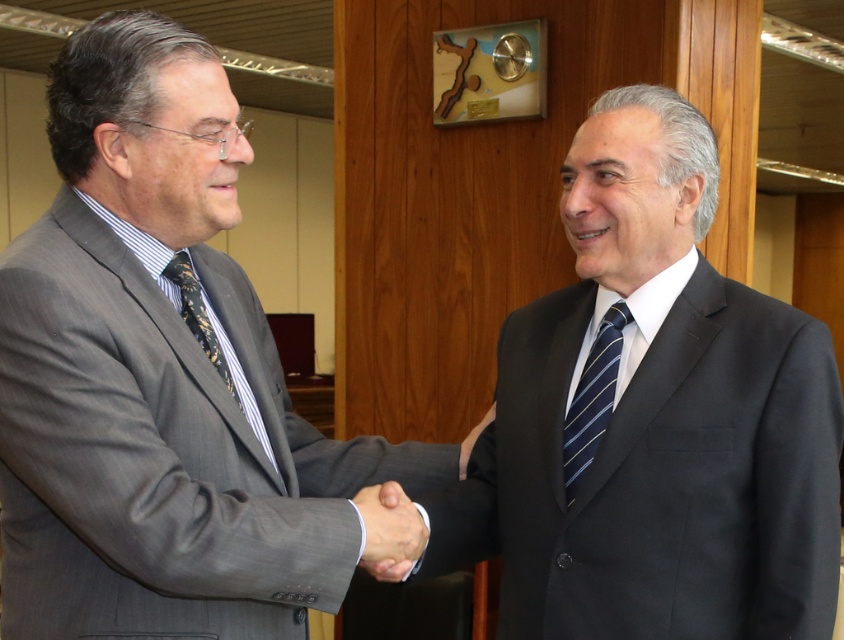
Question: Is dark gray suit at center in front of blue striped tie at center?

Choices:
 (A) yes
 (B) no

Answer: (A)

Question: Where is gray suit at left located in relation to black silk tie at left in the image?

Choices:
 (A) below
 (B) above

Answer: (B)

Question: Which point appears closest to the camera in this image?

Choices:
 (A) (580, 394)
 (B) (268, 454)
 (C) (356, 499)

Answer: (C)

Question: Which point is closer to the camera?

Choices:
 (A) blue striped tie at center
 (B) black silk tie at left
 (C) matte gray suit at center
 (D) dark gray suit at center

Answer: (C)

Question: Which point is farther from the camera taking this photo?

Choices:
 (A) (273, 570)
 (B) (375, 524)

Answer: (B)

Question: Can you confirm if gray suit at left is positioned to the left of matte gray suit at center?

Choices:
 (A) yes
 (B) no

Answer: (A)